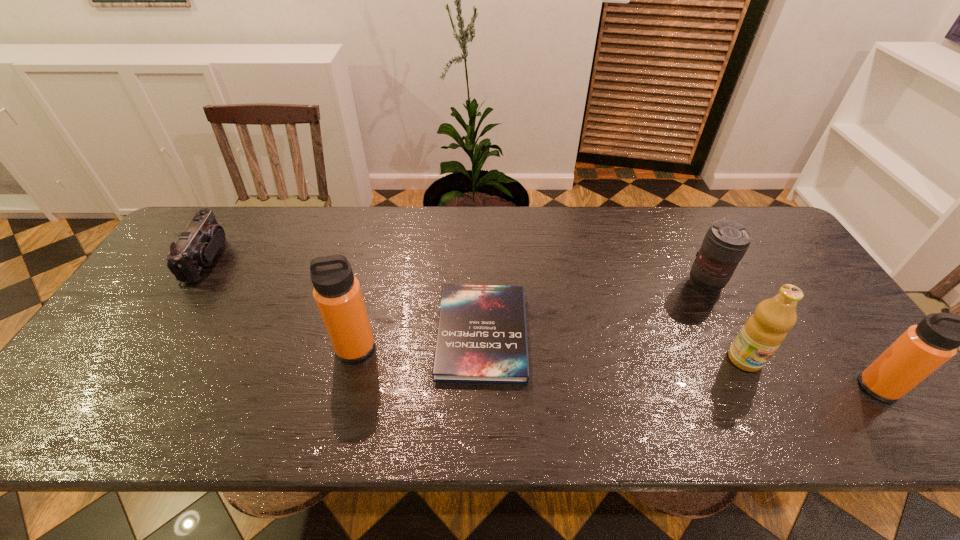
At what (x,y) coordinates should I click in order to perform the action: click on object that is at the left edge. Please return your answer as a coordinate pair (x, y). This screenshot has width=960, height=540. Looking at the image, I should click on (197, 245).

Where is `object that is at the right edge`? The height and width of the screenshot is (540, 960). object that is at the right edge is located at coordinates (922, 349).

Where is `object at the far left corner`? The image size is (960, 540). object at the far left corner is located at coordinates (197, 245).

Where is `object present at the near right corner`? The width and height of the screenshot is (960, 540). object present at the near right corner is located at coordinates (922, 349).

The height and width of the screenshot is (540, 960). In the image, there is a desktop. Identify the location of vacant space at the far edge. (x=525, y=234).

Locate an element on the screen. Image resolution: width=960 pixels, height=540 pixels. vacant region at the near edge of the desktop is located at coordinates (156, 386).

In the image, there is a desktop. Identify the location of free region at the near left corner. (94, 392).

At what (x,y) coordinates should I click in order to perform the action: click on free spot at the near right corner of the desktop. Please return your answer as a coordinate pair (x, y). This screenshot has width=960, height=540. Looking at the image, I should click on (854, 378).

In order to click on vacant space that's between the fourth tallest object and the olive oil in this screenshot , I will do `click(725, 322)`.

In order to click on vacant point located between the tallest object and the olive oil in this screenshot , I will do `click(550, 353)`.